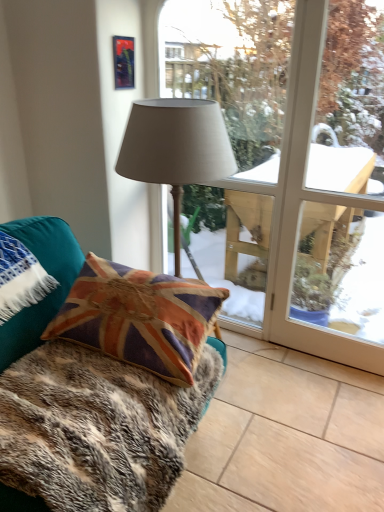
Question: Is matte gray fabric lamp at center aimed at velvet union jack pillow at lower left?

Choices:
 (A) no
 (B) yes

Answer: (B)

Question: Is matte gray fabric lamp at center next to velvet union jack pillow at lower left?

Choices:
 (A) yes
 (B) no

Answer: (B)

Question: Can you confirm if matte gray fabric lamp at center is positioned to the left of velvet union jack pillow at lower left?

Choices:
 (A) yes
 (B) no

Answer: (B)

Question: Can you confirm if matte gray fabric lamp at center is smaller than velvet union jack pillow at lower left?

Choices:
 (A) yes
 (B) no

Answer: (B)

Question: From a real-world perspective, is matte gray fabric lamp at center below velvet union jack pillow at lower left?

Choices:
 (A) yes
 (B) no

Answer: (B)

Question: Is matte gray fabric lamp at center bigger or smaller than fur-like fabric at lower left?

Choices:
 (A) big
 (B) small

Answer: (A)

Question: From a real-world perspective, is matte gray fabric lamp at center positioned above or below fur-like fabric at lower left?

Choices:
 (A) below
 (B) above

Answer: (B)

Question: Considering the positions of matte gray fabric lamp at center and fur-like fabric at lower left in the image, is matte gray fabric lamp at center taller or shorter than fur-like fabric at lower left?

Choices:
 (A) tall
 (B) short

Answer: (A)

Question: In terms of width, does matte gray fabric lamp at center look wider or thinner when compared to fur-like fabric at lower left?

Choices:
 (A) wide
 (B) thin

Answer: (B)

Question: In terms of height, does matte gray fabric lamp at center look taller or shorter compared to metallic reflective picture frame at upper center?

Choices:
 (A) short
 (B) tall

Answer: (B)

Question: Is matte gray fabric lamp at center spatially inside metallic reflective picture frame at upper center, or outside of it?

Choices:
 (A) outside
 (B) inside

Answer: (A)

Question: Does point (167, 151) appear closer or farther from the camera than point (122, 56)?

Choices:
 (A) farther
 (B) closer

Answer: (B)

Question: Would you say matte gray fabric lamp at center is to the left or to the right of metallic reflective picture frame at upper center in the picture?

Choices:
 (A) left
 (B) right

Answer: (B)

Question: From a real-world perspective, relative to matte gray lampshade at center, is matte gray fabric lamp at center vertically above or below?

Choices:
 (A) above
 (B) below

Answer: (A)

Question: From the image's perspective, is matte gray fabric lamp at center above or below matte gray lampshade at center?

Choices:
 (A) above
 (B) below

Answer: (B)